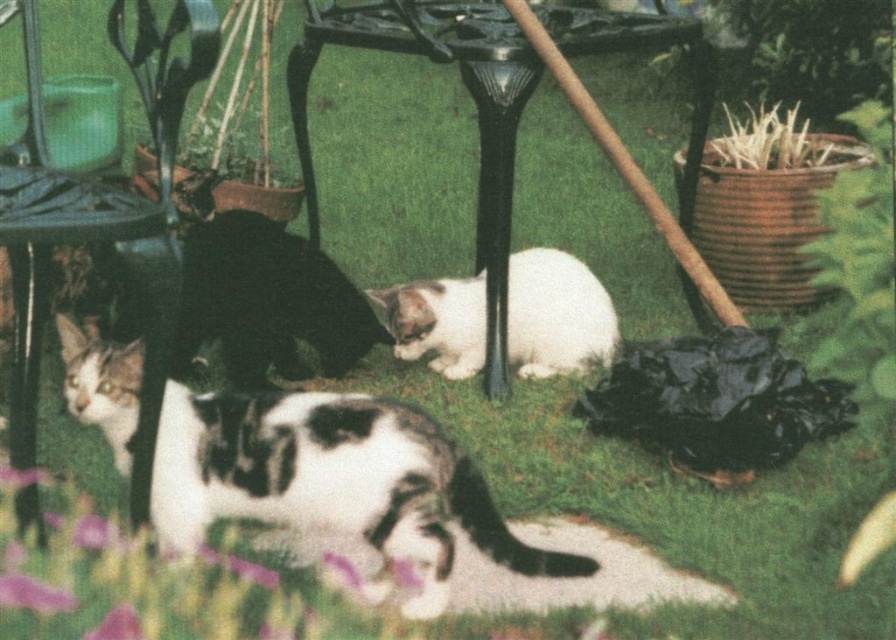
Question: Which object is farther from the camera taking this photo?

Choices:
 (A) white soft fur cat at center
 (B) metallic black chair at center

Answer: (A)

Question: Which point is closer to the camera?

Choices:
 (A) metallic black chair at left
 (B) white fur cat at center
 (C) metallic black chair at center
 (D) white soft fur cat at center

Answer: (A)

Question: Does metallic black chair at left appear on the right side of white soft fur cat at center?

Choices:
 (A) yes
 (B) no

Answer: (B)

Question: Which point is closer to the camera?

Choices:
 (A) click(x=573, y=307)
 (B) click(x=15, y=460)
 (C) click(x=373, y=584)

Answer: (C)

Question: Can you confirm if metallic black chair at left is thinner than white soft fur cat at center?

Choices:
 (A) yes
 (B) no

Answer: (A)

Question: Does white fur cat at center have a greater width compared to metallic black chair at left?

Choices:
 (A) yes
 (B) no

Answer: (A)